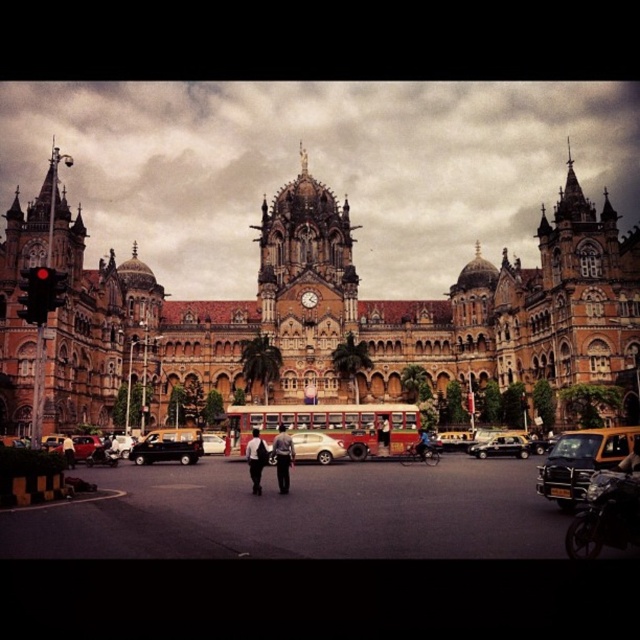
You are a photographer standing in front of the grand ornate building with the clock tower. You notice a white fabric shirt at center and a black fabric person at center in the scene. Which object would appear larger in your photo?

The white fabric shirt at center appears larger than the black fabric person at center in the photo.

You are standing at the center of the image, which is the clock tower. You want to hail a taxi to leave. Which direction should you walk to reach the yellow matte taxi at lower right?

You should walk towards the lower right direction to reach the yellow matte taxi at lower right since it is located at point (580, 461), which is the lower right area of the image.